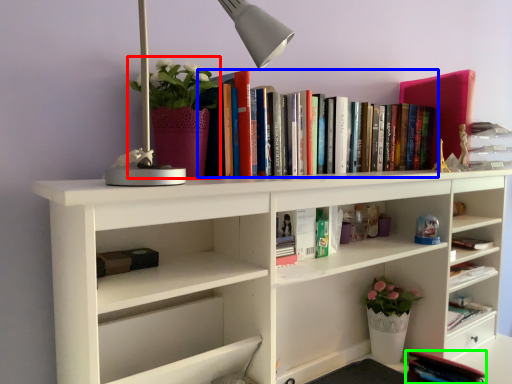
Question: Which object is the farthest from floral arrangement (highlighted by a red box)? Choose among these: book (highlighted by a blue box) or book (highlighted by a green box).

Choices:
 (A) book
 (B) book

Answer: (B)